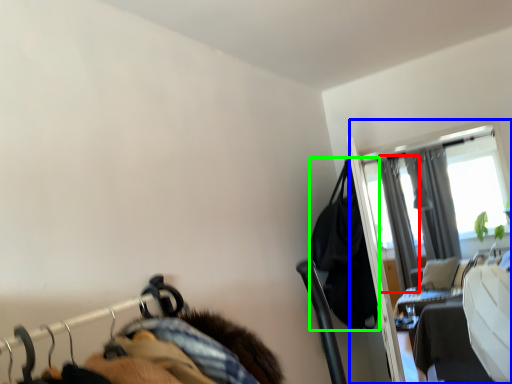
Question: Estimate the real-world distances between objects in this image. Which object is farther from curtain (highlighted by a red box), screen door (highlighted by a blue box) or clothing (highlighted by a green box)?

Choices:
 (A) screen door
 (B) clothing

Answer: (B)